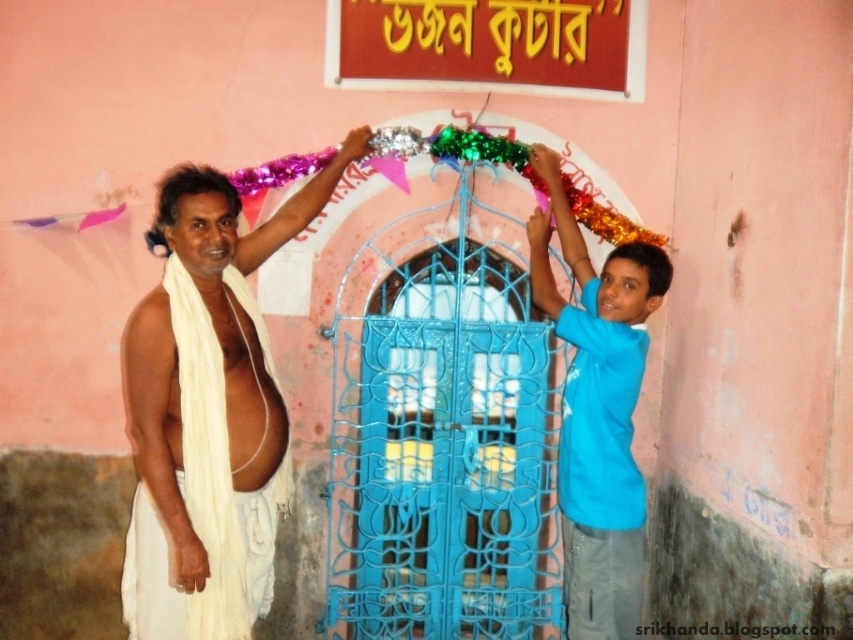
Based on the photo, is blue metallic gate at center to the right of white clothed man at left from the viewer's perspective?

Indeed, blue metallic gate at center is positioned on the right side of white clothed man at left.

Between blue metallic gate at center and white clothed man at left, which one is positioned lower?

blue metallic gate at center is below.

What do you see at coordinates (442, 435) in the screenshot? I see `blue metallic gate at center` at bounding box center [442, 435].

Find the location of `blue metallic gate at center`. blue metallic gate at center is located at coordinates (442, 435).

Is white cloth at right bigger than white cloth at left?

Yes, white cloth at right is bigger than white cloth at left.

What are the coordinates of `white cloth at right` in the screenshot? It's located at (601, 472).

Who is higher up, white clothed man at left or blue t-shirt at right?

white clothed man at left is higher up.

Does white clothed man at left have a smaller size compared to blue t-shirt at right?

Actually, white clothed man at left might be larger than blue t-shirt at right.

Describe the element at coordinates (207, 410) in the screenshot. I see `white clothed man at left` at that location.

Image resolution: width=853 pixels, height=640 pixels. I want to click on white clothed man at left, so click(x=207, y=410).